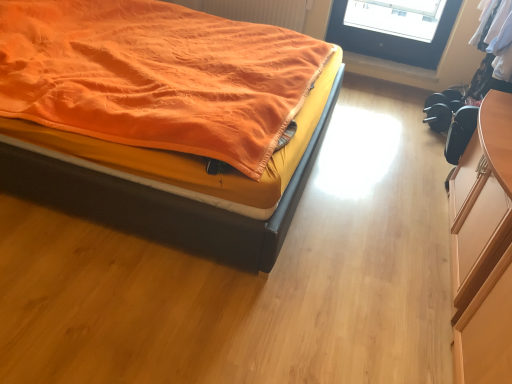
Question: Considering the relative positions of orange fabric radiator at upper center and orange fabric bed at upper left in the image provided, is orange fabric radiator at upper center to the right of orange fabric bed at upper left from the viewer's perspective?

Choices:
 (A) yes
 (B) no

Answer: (A)

Question: Is orange fabric radiator at upper center positioned beyond the bounds of orange fabric bed at upper left?

Choices:
 (A) yes
 (B) no

Answer: (A)

Question: From the image's perspective, is orange fabric radiator at upper center under orange fabric bed at upper left?

Choices:
 (A) yes
 (B) no

Answer: (B)

Question: Considering the relative sizes of orange fabric radiator at upper center and orange fabric bed at upper left in the image provided, is orange fabric radiator at upper center shorter than orange fabric bed at upper left?

Choices:
 (A) no
 (B) yes

Answer: (B)

Question: Is orange fabric radiator at upper center looking in the opposite direction of orange fabric bed at upper left?

Choices:
 (A) no
 (B) yes

Answer: (A)

Question: Considering the relative positions of wooden at lower right and orange fabric radiator at upper center in the image provided, is wooden at lower right to the left or to the right of orange fabric radiator at upper center?

Choices:
 (A) left
 (B) right

Answer: (B)

Question: In the image, is wooden at lower right positioned in front of or behind orange fabric radiator at upper center?

Choices:
 (A) behind
 (B) front

Answer: (A)

Question: Is point (348, 59) closer or farther from the camera than point (287, 23)?

Choices:
 (A) farther
 (B) closer

Answer: (A)

Question: From the image's perspective, is wooden at lower right located above or below orange fabric radiator at upper center?

Choices:
 (A) above
 (B) below

Answer: (B)

Question: Is point (350, 66) positioned closer to the camera than point (10, 187)?

Choices:
 (A) closer
 (B) farther

Answer: (B)

Question: From the image's perspective, relative to orange fabric bed at upper left, is wooden at lower right above or below?

Choices:
 (A) above
 (B) below

Answer: (A)

Question: Considering their positions, is wooden at lower right located in front of or behind orange fabric bed at upper left?

Choices:
 (A) behind
 (B) front

Answer: (A)

Question: Considering the positions of wooden at lower right and orange fabric bed at upper left in the image, is wooden at lower right wider or thinner than orange fabric bed at upper left?

Choices:
 (A) thin
 (B) wide

Answer: (A)

Question: Which is correct: orange fabric bed at upper left is inside orange fabric radiator at upper center, or outside of it?

Choices:
 (A) inside
 (B) outside

Answer: (B)

Question: Does point (202, 173) appear closer or farther from the camera than point (267, 4)?

Choices:
 (A) farther
 (B) closer

Answer: (B)